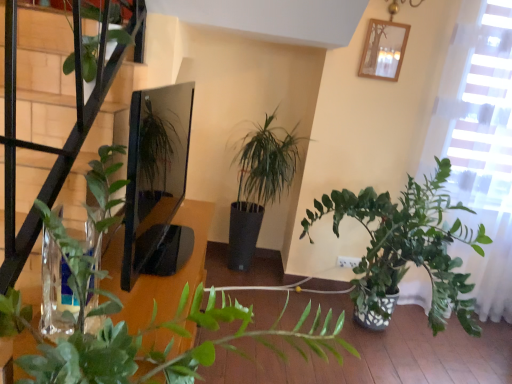
Question: Does green leafy plant at upper left have a larger size compared to green matte plant at center?

Choices:
 (A) yes
 (B) no

Answer: (B)

Question: Does green leafy plant at upper left contain green matte plant at center?

Choices:
 (A) yes
 (B) no

Answer: (B)

Question: Can you confirm if green leafy plant at upper left is taller than green matte plant at center?

Choices:
 (A) yes
 (B) no

Answer: (B)

Question: Is green leafy plant at upper left closer to camera compared to green matte plant at center?

Choices:
 (A) no
 (B) yes

Answer: (A)

Question: From the image's perspective, is green leafy plant at upper left on top of green matte plant at center?

Choices:
 (A) yes
 (B) no

Answer: (A)

Question: Does green leafy plant at upper left have a smaller size compared to green matte plant at center?

Choices:
 (A) yes
 (B) no

Answer: (A)

Question: Does green leafy plant at upper left have a larger size compared to wooden picture frame at upper center?

Choices:
 (A) yes
 (B) no

Answer: (A)

Question: Can you confirm if green leafy plant at upper left is shorter than wooden picture frame at upper center?

Choices:
 (A) yes
 (B) no

Answer: (B)

Question: Is green leafy plant at upper left closer to the viewer compared to wooden picture frame at upper center?

Choices:
 (A) no
 (B) yes

Answer: (B)

Question: Is green leafy plant at upper left at the left side of wooden picture frame at upper center?

Choices:
 (A) no
 (B) yes

Answer: (B)

Question: Is green leafy plant at upper left not inside wooden picture frame at upper center?

Choices:
 (A) yes
 (B) no

Answer: (A)

Question: Can you confirm if green leafy plant at upper left is smaller than wooden picture frame at upper center?

Choices:
 (A) no
 (B) yes

Answer: (A)

Question: Can you see wooden picture frame at upper center touching green leafy plant at upper left?

Choices:
 (A) no
 (B) yes

Answer: (A)